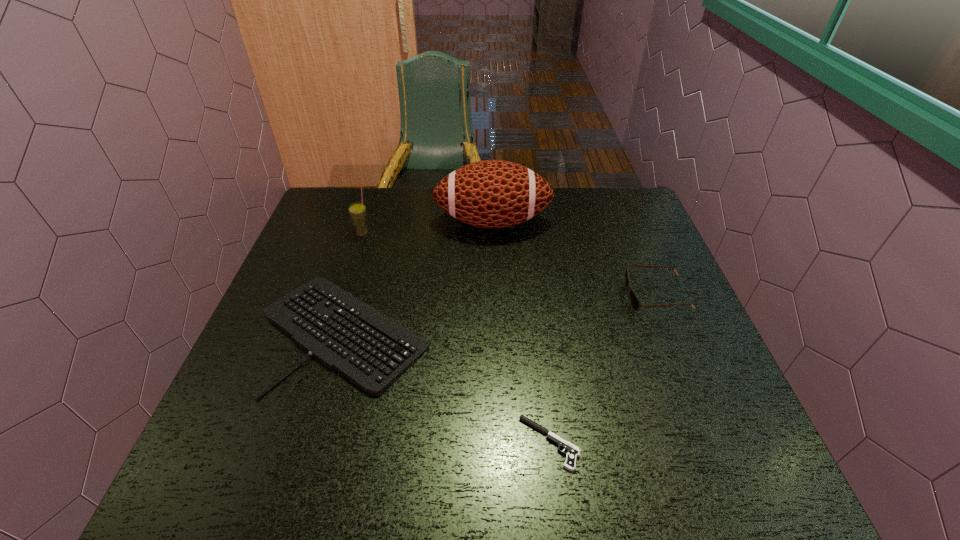
Where is `free space located 0.110m on the lenses of the rightmost object`? This screenshot has width=960, height=540. free space located 0.110m on the lenses of the rightmost object is located at coordinates (583, 296).

You are a GUI agent. You are given a task and a screenshot of the screen. Output one action in this format:
    pyautogui.click(x=<x>, y=<y>)
    Task: Click on the free location located 0.090m on the lenses of the rightmost object
    
    Given the screenshot: What is the action you would take?
    pyautogui.click(x=590, y=296)

Find the location of `free spot located 0.290m on the right of the computer keyboard`. free spot located 0.290m on the right of the computer keyboard is located at coordinates (555, 332).

You are a GUI agent. You are given a task and a screenshot of the screen. Output one action in this format:
    pyautogui.click(x=<x>, y=<y>)
    Task: Click on the free location located on the front-facing side of the pistol
    The width and height of the screenshot is (960, 540).
    Given the screenshot: What is the action you would take?
    pyautogui.click(x=351, y=443)

Identify the location of vacant space located on the front-facing side of the pistol. pyautogui.click(x=389, y=443).

Find the location of a particular element. The height and width of the screenshot is (540, 960). vacant space located 0.190m on the front-facing side of the pistol is located at coordinates (420, 443).

Locate an element on the screen. football present at the far edge is located at coordinates (491, 193).

You are a GUI agent. You are given a task and a screenshot of the screen. Output one action in this format:
    pyautogui.click(x=<x>, y=<y>)
    Task: Click on the straw for drinking present at the far edge
    This screenshot has width=960, height=540.
    Given the screenshot: What is the action you would take?
    pos(358,213)

Locate an element on the screen. object present at the near edge is located at coordinates (572, 452).

Locate an element on the screen. straw for drinking located at the left edge is located at coordinates pos(358,213).